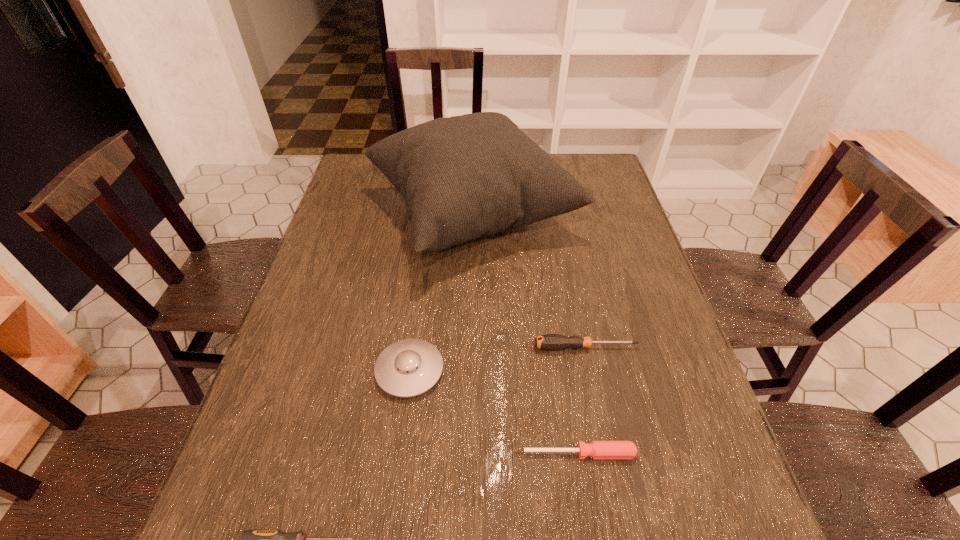
Find the location of a particular element. This screenshot has height=540, width=960. screwdriver that is the nearest to the second nearest screwdriver is located at coordinates (552, 342).

In order to click on the closest screwdriver relative to the second farthest screwdriver in this screenshot , I will do `click(552, 342)`.

Image resolution: width=960 pixels, height=540 pixels. Find the location of `vacant area in the image that satisfies the following two spatial constraints: 1. on the back side of the second farthest screwdriver; 2. on the right side of the third shortest object`. vacant area in the image that satisfies the following two spatial constraints: 1. on the back side of the second farthest screwdriver; 2. on the right side of the third shortest object is located at coordinates (563, 347).

Where is `free space that satisfies the following two spatial constraints: 1. on the front side of the farthest object; 2. on the right side of the second nearest screwdriver`? This screenshot has height=540, width=960. free space that satisfies the following two spatial constraints: 1. on the front side of the farthest object; 2. on the right side of the second nearest screwdriver is located at coordinates (467, 453).